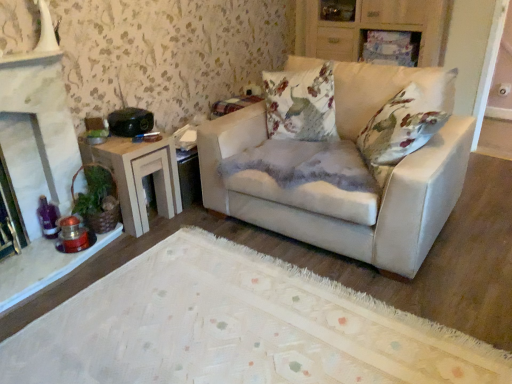
In order to face matte white couch at center, should I rotate leftwards or rightwards?

Turn right by 10.301 degrees to look at matte white couch at center.

Locate an element on the screen. This screenshot has height=384, width=512. white stone fireplace at left is located at coordinates click(36, 164).

You are a GUI agent. You are given a task and a screenshot of the screen. Output one action in this format:
    pyautogui.click(x=<x>, y=<y>)
    Task: Click on the wooden side table at left
    This screenshot has height=384, width=512.
    Given the screenshot: What is the action you would take?
    pyautogui.click(x=139, y=176)

You are a GUI agent. You are given a task and a screenshot of the screen. Output one action in this format:
    pyautogui.click(x=<x>, y=<y>)
    Task: Click on the matte white couch at center
    This screenshot has height=384, width=512.
    Given the screenshot: What is the action you would take?
    pyautogui.click(x=341, y=195)

Is wooden cabinet at upper center surrounded by wooden side table at left?

Definitely not — wooden cabinet at upper center is not inside wooden side table at left.

Between wooden side table at left and wooden cabinet at upper center, which one has larger size?

With larger size is wooden cabinet at upper center.

Who is shorter, wooden side table at left or wooden cabinet at upper center?

With less height is wooden side table at left.

Which is behind, point (170, 209) or point (431, 29)?

The point (431, 29) is farther from the camera.

Can you tell me how much wooden side table at left and white stone fireplace at left differ in facing direction?

1.79 degrees.

Based on their sizes in the image, would you say wooden side table at left is bigger or smaller than white stone fireplace at left?

In the image, wooden side table at left appears to be smaller than white stone fireplace at left.

Can you confirm if wooden side table at left is thinner than white stone fireplace at left?

In fact, wooden side table at left might be wider than white stone fireplace at left.

From the image's perspective, between wooden side table at left and white stone fireplace at left, which one is located above?

From the image's view, white stone fireplace at left is above.

From a real-world perspective, is matte white couch at center above or below wooden cabinet at upper center?

In terms of real-world spatial position, matte white couch at center is below wooden cabinet at upper center.

Who is smaller, matte white couch at center or wooden cabinet at upper center?

With smaller size is wooden cabinet at upper center.

At what (x,y) coordinates should I click in order to perform the action: click on dresser located above the matte white couch at center (from the image's perspective). Please return your answer as a coordinate pair (x, y). Image resolution: width=512 pixels, height=384 pixels. Looking at the image, I should click on (372, 27).

Is white stone fireplace at left facing towards wooden side table at left?

No, white stone fireplace at left is not oriented towards wooden side table at left.

Considering the sizes of objects white stone fireplace at left and wooden side table at left in the image provided, who is thinner, white stone fireplace at left or wooden side table at left?

white stone fireplace at left.

Is white stone fireplace at left at the right side of wooden side table at left?

In fact, white stone fireplace at left is to the left of wooden side table at left.

In terms of height, does white stone fireplace at left look taller or shorter compared to wooden side table at left?

white stone fireplace at left is taller than wooden side table at left.

Considering their positions, is wooden side table at left located in front of or behind matte white couch at center?

In the image, wooden side table at left appears behind matte white couch at center.

Is point (125, 179) closer or farther from the camera than point (409, 175)?

Clearly, point (125, 179) is more distant from the camera than point (409, 175).

From the image's perspective, which one is positioned lower, wooden side table at left or matte white couch at center?

wooden side table at left appears lower in the image.

From a real-world perspective, is wooden side table at left on top of matte white couch at center?

No, from a real-world perspective, wooden side table at left is not on top of matte white couch at center.

Is white stone fireplace at left aimed at wooden cabinet at upper center?

No, white stone fireplace at left is not oriented towards wooden cabinet at upper center.

What's the angular difference between white stone fireplace at left and wooden cabinet at upper center's facing directions?

The facing directions of white stone fireplace at left and wooden cabinet at upper center are 90.2 degrees apart.

From the image's perspective, is white stone fireplace at left beneath wooden cabinet at upper center?

Correct, white stone fireplace at left appears lower than wooden cabinet at upper center in the image.

Is white stone fireplace at left placed right next to wooden cabinet at upper center?

No, white stone fireplace at left is not beside wooden cabinet at upper center.

Is wooden cabinet at upper center to the right of wooden side table at left from the viewer's perspective?

Yes.

Is wooden cabinet at upper center spatially inside wooden side table at left, or outside of it?

wooden cabinet at upper center is spatially situated outside wooden side table at left.

Considering the sizes of objects wooden cabinet at upper center and wooden side table at left in the image provided, who is wider, wooden cabinet at upper center or wooden side table at left?

Wider between the two is wooden side table at left.

This screenshot has width=512, height=384. Find the location of `table beneath the wooden cabinet at upper center (from a real-world perspective)`. table beneath the wooden cabinet at upper center (from a real-world perspective) is located at coordinates (139, 176).

You are a GUI agent. You are given a task and a screenshot of the screen. Output one action in this format:
    pyautogui.click(x=<x>, y=<y>)
    Task: Click on the table lying behind the white stone fireplace at left
    
    Given the screenshot: What is the action you would take?
    pyautogui.click(x=139, y=176)

From the image, which object appears to be farther from wooden cabinet at upper center, wooden side table at left or white stone fireplace at left?

white stone fireplace at left.

Looking at the image, which one is located further to wooden side table at left, matte white couch at center or white stone fireplace at left?

matte white couch at center is positioned further to the anchor wooden side table at left.

Estimate the real-world distances between objects in this image. Which object is further from matte white couch at center, wooden side table at left or wooden cabinet at upper center?

The object further to matte white couch at center is wooden cabinet at upper center.

Estimate the real-world distances between objects in this image. Which object is further from wooden side table at left, white stone fireplace at left or matte white couch at center?

matte white couch at center lies further to wooden side table at left than the other object.

Estimate the real-world distances between objects in this image. Which object is closer to wooden side table at left, wooden cabinet at upper center or matte white couch at center?

Based on the image, matte white couch at center appears to be nearer to wooden side table at left.

Looking at the image, which one is located closer to white stone fireplace at left, wooden cabinet at upper center or wooden side table at left?

Among the two, wooden side table at left is located nearer to white stone fireplace at left.

From the image, which object appears to be farther from matte white couch at center, wooden cabinet at upper center or white stone fireplace at left?

wooden cabinet at upper center.

Based on the photo, which object lies nearer to the anchor point matte white couch at center, wooden cabinet at upper center or wooden side table at left?

The object closer to matte white couch at center is wooden side table at left.

Find the location of a particular element. studio couch situated between wooden side table at left and wooden cabinet at upper center from left to right is located at coordinates (341, 195).

Find the location of a particular element. studio couch located between white stone fireplace at left and wooden cabinet at upper center in the left-right direction is located at coordinates (341, 195).

The image size is (512, 384). What are the coordinates of `table situated between white stone fireplace at left and wooden cabinet at upper center from left to right` in the screenshot? It's located at (139, 176).

Find the location of a particular element. The height and width of the screenshot is (384, 512). table between white stone fireplace at left and matte white couch at center from left to right is located at coordinates (139, 176).